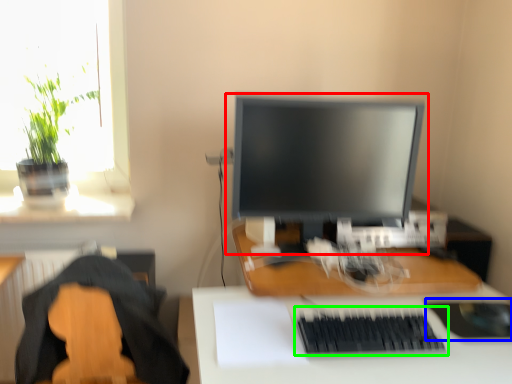
Question: Which is farther away from computer monitor (highlighted by a red box)? mousepad (highlighted by a blue box) or computer keyboard (highlighted by a green box)?

Choices:
 (A) mousepad
 (B) computer keyboard

Answer: (A)